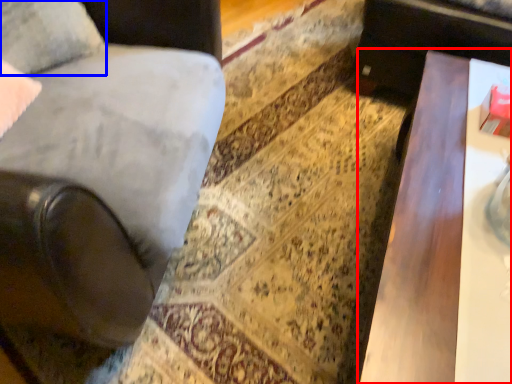
Question: Which object appears farthest to the camera in this image, table (highlighted by a red box) or pillow (highlighted by a blue box)?

Choices:
 (A) table
 (B) pillow

Answer: (B)